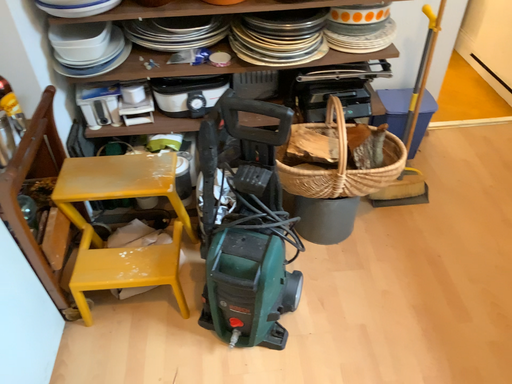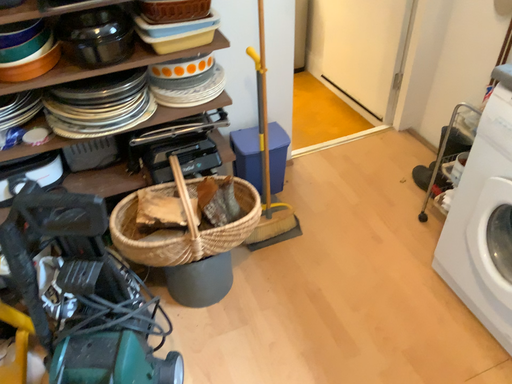
Question: How did the camera likely rotate when shooting the video?

Choices:
 (A) rotated right
 (B) rotated left

Answer: (A)